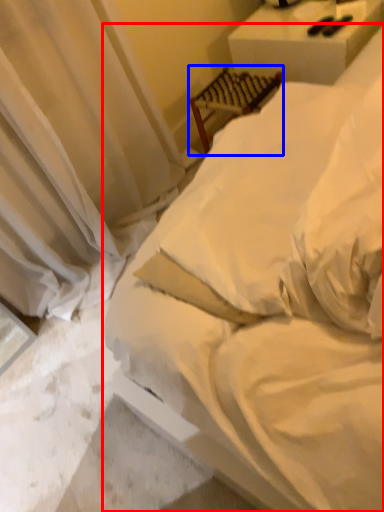
Question: Among these objects, which one is farthest to the camera, bed (highlighted by a red box) or furniture (highlighted by a blue box)?

Choices:
 (A) bed
 (B) furniture

Answer: (B)